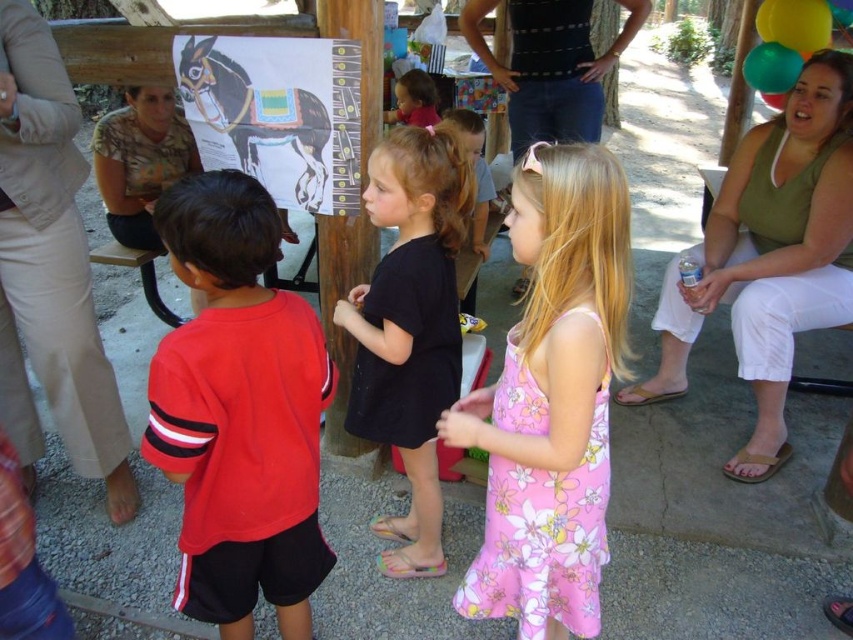
You are a photographer trying to capture a photo of the children without any balloons in the frame. The green matte balloon at upper right and the translucent green balloon at upper right are both in your current view. Which balloon should you move closer to the camera to ensure it is out of the frame?

The green matte balloon at upper right is wider than the translucent green balloon at upper right. To remove it from the frame, you should move the green matte balloon at upper right closer to the camera since its larger size would make it easier to position it outside the frame.

You are a photographer trying to capture a photo of the children in the foreground without the balloons in the background. Given that you can only move forward or backward, which balloon should you position yourself closer to to ensure the green matte balloon at upper right and the translucent green balloon at upper right are both out of frame?

To ensure both balloons are out of frame, you should position yourself closer to the green matte balloon at upper right since it is closer to the viewer than the translucent green balloon at upper right. By moving closer to the green matte balloon at upper right, you can block the view of both balloons while keeping the children in focus.